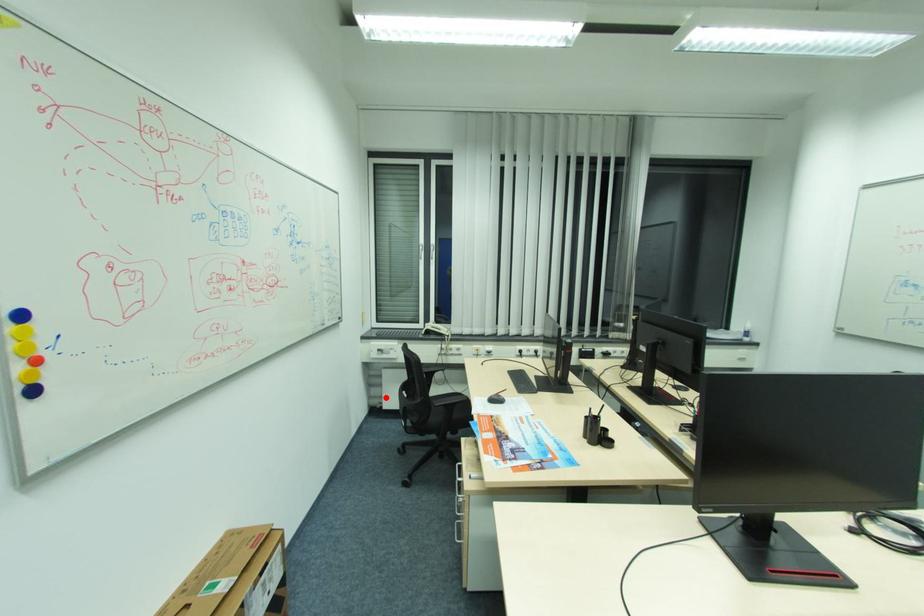
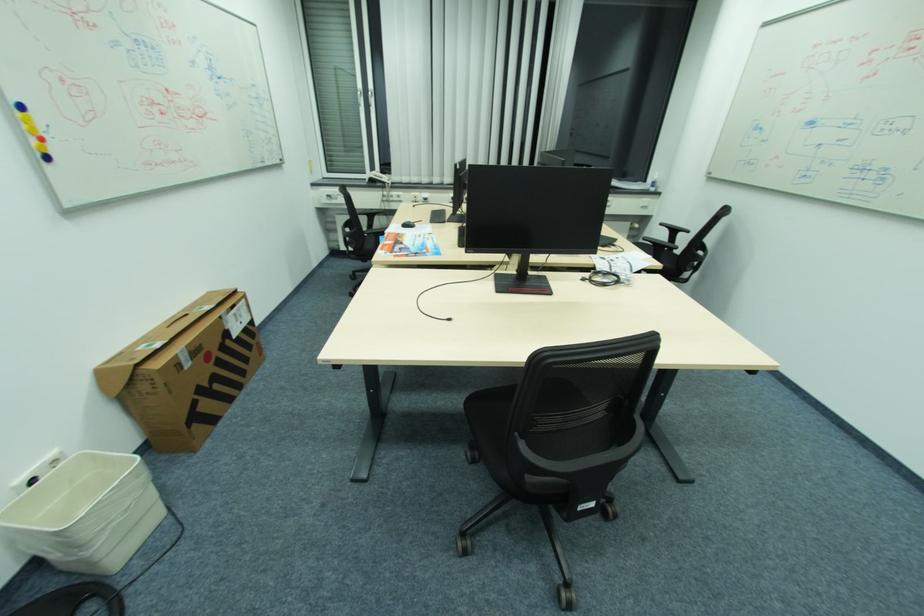
Question: I am providing you with two images of the same scene from different viewpoints. A red point is shown in image1. For the corresponding object point in image2, is it positioned nearer or farther from the camera?

Choices:
 (A) Nearer
 (B) Farther

Answer: (A)